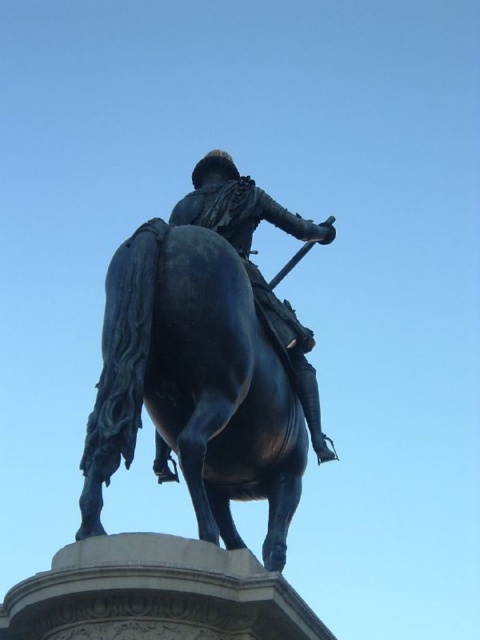
Between point (201, 333) and point (277, 224), which one is positioned in front?

Positioned in front is point (201, 333).

At what (x,y) coordinates should I click in order to perform the action: click on shiny black horse at center. Please return your answer as a coordinate pair (x, y). Image resolution: width=480 pixels, height=640 pixels. Looking at the image, I should click on (194, 385).